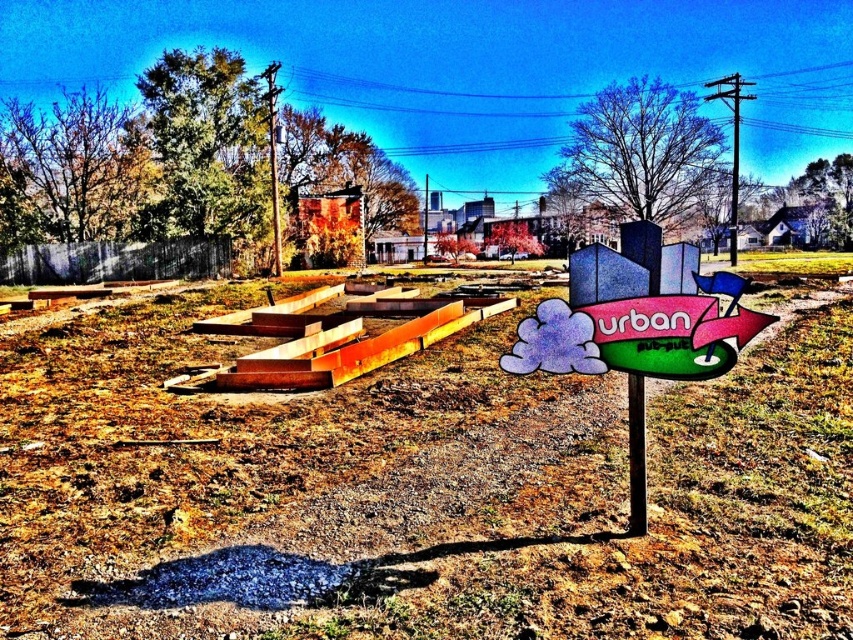
Question: Which is nearer to the metallic pole at upper right?

Choices:
 (A) metallic pole at center
 (B) metallic pole at upper center

Answer: (B)

Question: Estimate the real-world distances between objects in this image. Which object is closer to the metallic pole at upper center?

Choices:
 (A) metallic pole at center
 (B) wooden boards at center
 (C) metallic pole at upper right

Answer: (C)

Question: Is metallic pole at upper center below metallic pole at center?

Choices:
 (A) yes
 (B) no

Answer: (B)

Question: Is wooden boards at center wider than metallic pole at upper center?

Choices:
 (A) no
 (B) yes

Answer: (B)

Question: Can you confirm if metallic pole at upper right is positioned above metallic pole at upper center?

Choices:
 (A) no
 (B) yes

Answer: (A)

Question: Which point is closer to the camera?

Choices:
 (A) (735, 253)
 (B) (190, 548)
 (C) (425, 225)
 (D) (732, 108)

Answer: (B)